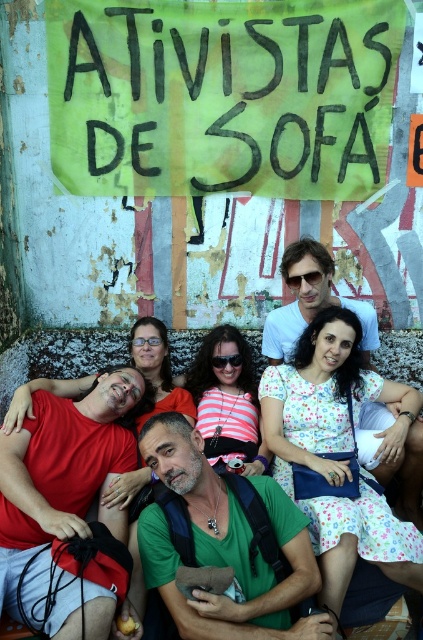
You are standing in front of the graffiti wall and see the point at coordinates (222, 96). Which object from the scene does this point lie on?

The point at coordinates (222, 96) lies on the green painted cardboard sign at upper center.

You are a photographer trying to capture the group photo. You notice the green painted cardboard sign at upper center and the green fabric shirt at center. Which object is positioned higher in the image?

The green painted cardboard sign at upper center is positioned higher in the image than the green fabric shirt at center.